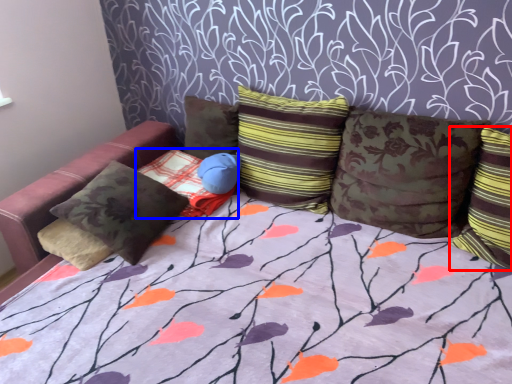
Question: Which object appears farthest to the camera in this image, pillow (highlighted by a red box) or pillow (highlighted by a blue box)?

Choices:
 (A) pillow
 (B) pillow

Answer: (B)